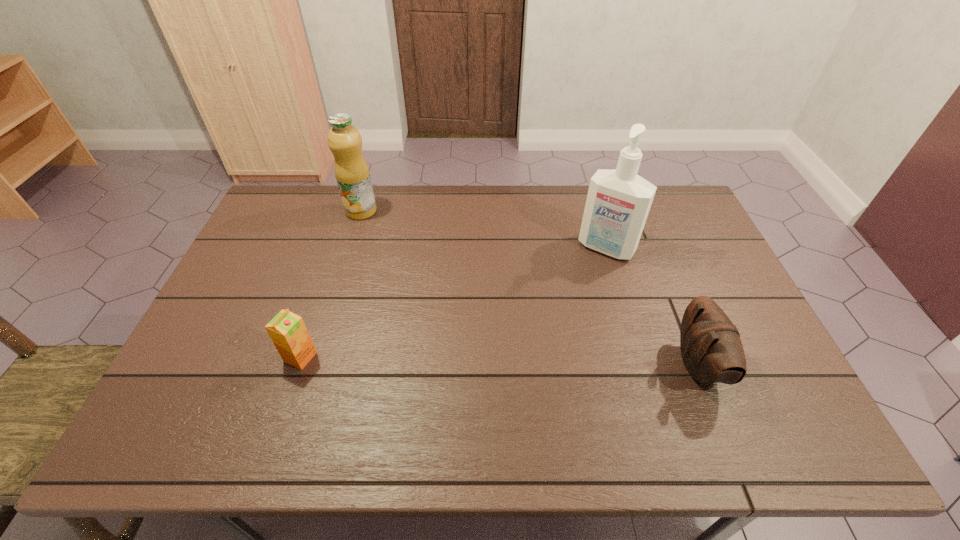
At what (x,y) coordinates should I click in order to perform the action: click on vacant area between the pouch and the fruit juice. Please return your answer as a coordinate pair (x, y). This screenshot has width=960, height=540. Looking at the image, I should click on (530, 288).

The height and width of the screenshot is (540, 960). In order to click on free point between the rightmost object and the orange juice in this screenshot , I will do `click(499, 361)`.

The width and height of the screenshot is (960, 540). Identify the location of vacant area that lies between the cleansing agent and the orange juice. (453, 302).

Locate an element on the screen. Image resolution: width=960 pixels, height=540 pixels. free space between the tallest object and the orange juice is located at coordinates (453, 302).

The image size is (960, 540). What are the coordinates of `object that is the third closest one to the pouch` in the screenshot? It's located at (351, 170).

Locate which object is the second closest to the rightmost object. Please provide its 2D coordinates. Your answer should be formatted as a tuple, i.e. [(x, y)], where the tuple contains the x and y coordinates of a point satisfying the conditions above.

[(287, 330)]

Locate an element on the screen. vacant space that satisfies the following two spatial constraints: 1. on the front side of the second farthest object; 2. with the flap open on the pouch is located at coordinates (641, 365).

At what (x,y) coordinates should I click in order to perform the action: click on free space that satisfies the following two spatial constraints: 1. on the front side of the pouch; 2. with the flap open on the cleansing agent. Please return your answer as a coordinate pair (x, y). Looking at the image, I should click on [641, 365].

Where is `vacant position in the image that satisfies the following two spatial constraints: 1. on the front side of the rightmost object; 2. with the flap open on the cleansing agent`? vacant position in the image that satisfies the following two spatial constraints: 1. on the front side of the rightmost object; 2. with the flap open on the cleansing agent is located at coordinates (641, 365).